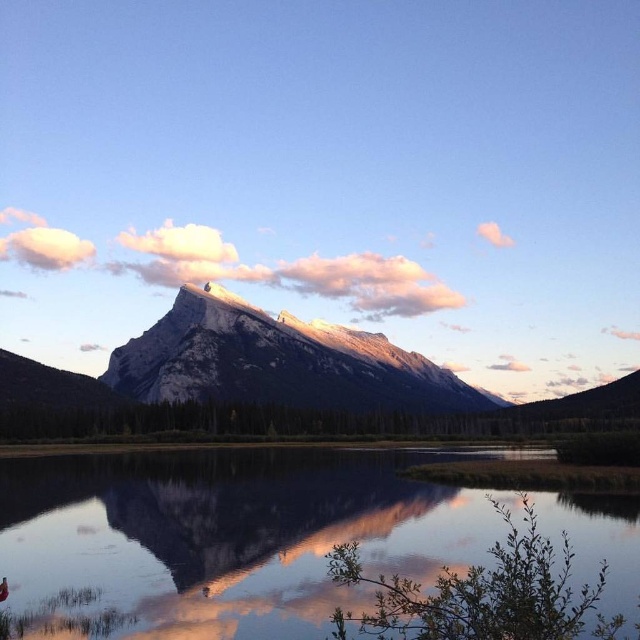
You are an artist planning to paint this landscape. You want to ensure that the transparent water at center and the snowy rock mountain at center are proportionally accurate. Based on the scene, which object should you make larger in your painting?

The snowy rock mountain at center should be made larger than the transparent water at center because it occupies more space in the scene according to the description.

You are an artist painting the sky in the scene. You want to ensure the white fluffy cloud at upper center and the pink cotton cloud at upper right are proportionally accurate. Which cloud should you draw taller?

The white fluffy cloud at upper center should be drawn taller than the pink cotton cloud at upper right because it is much taller according to the description.

You are a hiker planning to cross the transparent water at center to reach the snowy rock mountain at center. The bridge you plan to use can only support a distance of 200 meters. Will you be able to cross safely?

The transparent water at center and snowy rock mountain at center are 241.56 meters apart from each other. Since the bridge can only support 200 meters, it is not long enough. You will not be able to cross safely.